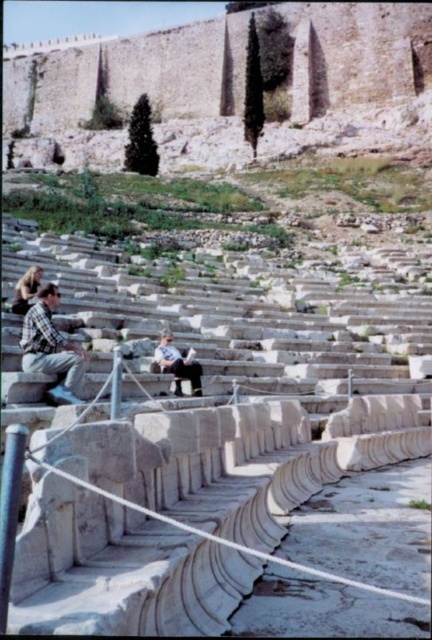
Does point (79, 353) lie in front of point (19, 310)?

Yes.

Image resolution: width=432 pixels, height=640 pixels. What do you see at coordinates (50, 348) in the screenshot?
I see `plaid shirt at center` at bounding box center [50, 348].

Who is more distant from viewer, (57, 349) or (19, 314)?

Positioned behind is point (19, 314).

You are a GUI agent. You are given a task and a screenshot of the screen. Output one action in this format:
    pyautogui.click(x=<x>, y=<y>)
    Task: Click on the plaid shirt at center
    
    Given the screenshot: What is the action you would take?
    [50, 348]

Does light brown leather jacket at center appear on the left side of light brown hair at left?

In fact, light brown leather jacket at center is to the right of light brown hair at left.

Who is more forward, (168, 339) or (25, 284)?

Point (168, 339) is in front.

At what (x,y) coordinates should I click in order to perform the action: click on light brown leather jacket at center. Please return your answer as a coordinate pair (x, y). Looking at the image, I should click on (177, 364).

Can you confirm if plaid shirt at center is positioned below light brown leather jacket at center?

Incorrect, plaid shirt at center is not positioned below light brown leather jacket at center.

Is plaid shirt at center further to the viewer compared to light brown leather jacket at center?

No, plaid shirt at center is closer to the viewer.

Is point (34, 337) positioned before point (162, 372)?

Yes, it is.

At what (x,y) coordinates should I click in order to perform the action: click on plaid shirt at center. Please return your answer as a coordinate pair (x, y). This screenshot has width=432, height=640. Looking at the image, I should click on (50, 348).